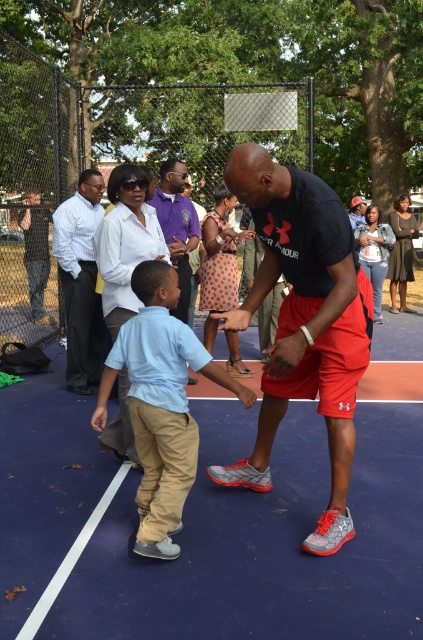
You are a photographer standing at the edge of the basketball court. You need to position yourself so that both the light blue cotton shirt at center and the purple cotton polo shirt at upper center are visible in your shot. Based on their positions, which shirt should you focus on first to ensure both are in frame?

Since the light blue cotton shirt at center is to the right of the purple cotton polo shirt at upper center, you should focus on the purple cotton polo shirt at upper center first to ensure both are in frame as they are positioned side by side with the purple one being on the left.

You are standing at the center of the basketball court and want to throw a ball to the white shirt at left. In which direction should you throw the ball to reach them?

The white shirt at left is located at coordinates approximately 0.441 on the x axis and 0.191 on the y axis. Since you are at the center, you should throw the ball to the left and slightly forward to reach the white shirt at left.